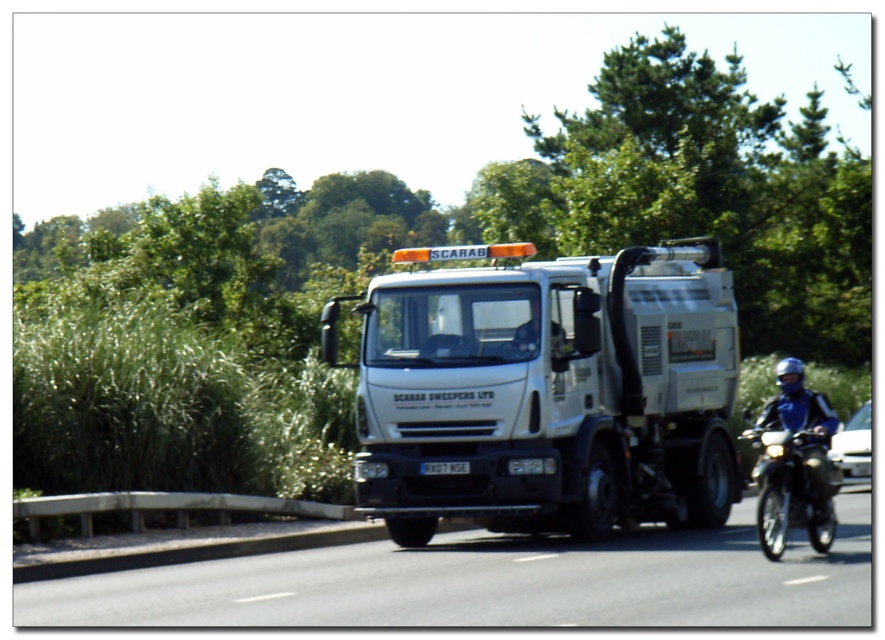
Question: Which point is closer to the camera?

Choices:
 (A) (812, 531)
 (B) (524, 362)
 (C) (299, 612)
 (D) (798, 369)

Answer: (C)

Question: Can you confirm if white matte truck at center is positioned above black asphalt road at center?

Choices:
 (A) no
 (B) yes

Answer: (B)

Question: Which point is farther from the camera taking this photo?

Choices:
 (A) (516, 593)
 (B) (649, 314)
 (C) (789, 518)

Answer: (B)

Question: Is white matte truck at center above black asphalt road at center?

Choices:
 (A) no
 (B) yes

Answer: (B)

Question: Does black asphalt road at center have a larger size compared to shiny black motorcycle at right?

Choices:
 (A) no
 (B) yes

Answer: (B)

Question: Estimate the real-world distances between objects in this image. Which object is closer to the black asphalt road at center?

Choices:
 (A) shiny black motorcycle at right
 (B) blue leather jacket at right

Answer: (A)